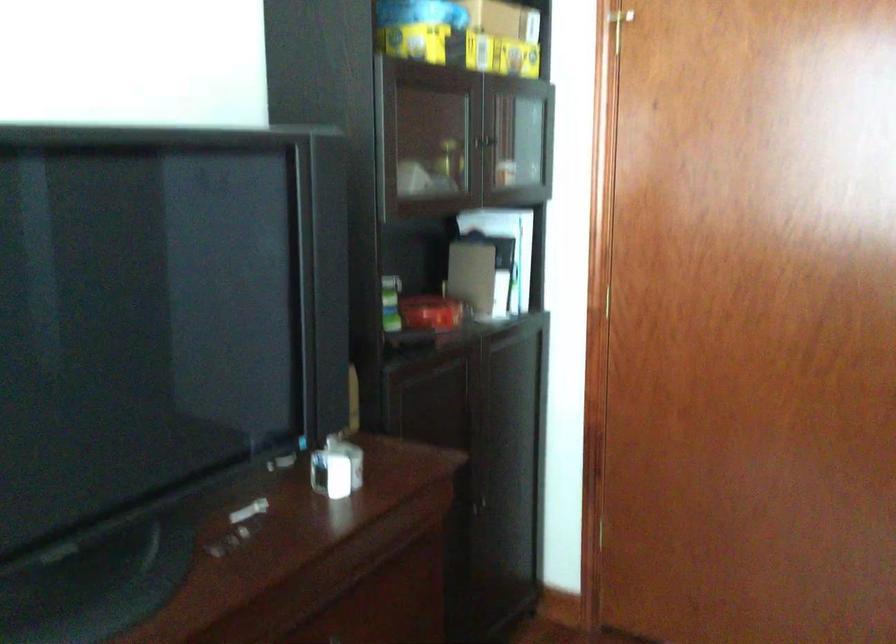
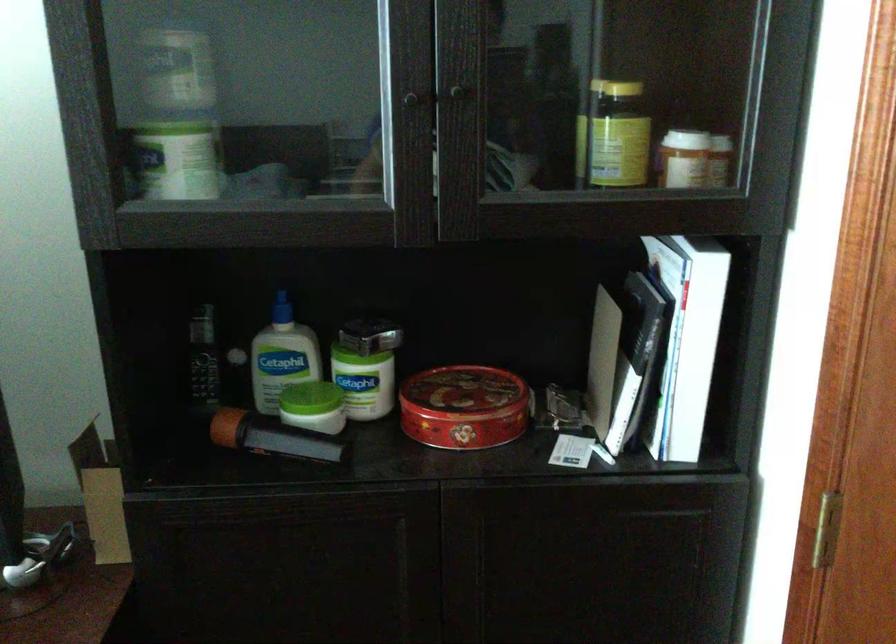
Find the pixel in the second image that matches the point at 492,136 in the first image.

(454, 91)